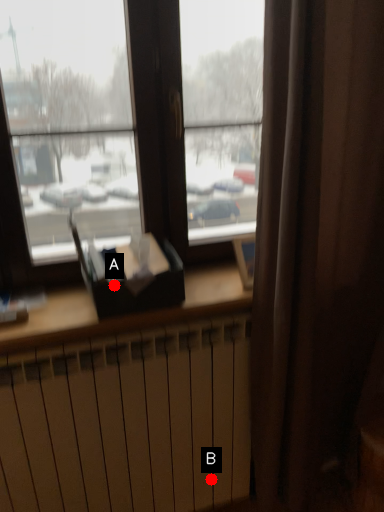
Question: Two points are circled on the image, labeled by A and B beside each circle. Which point is closer to the camera?

Choices:
 (A) A is closer
 (B) B is closer

Answer: (A)